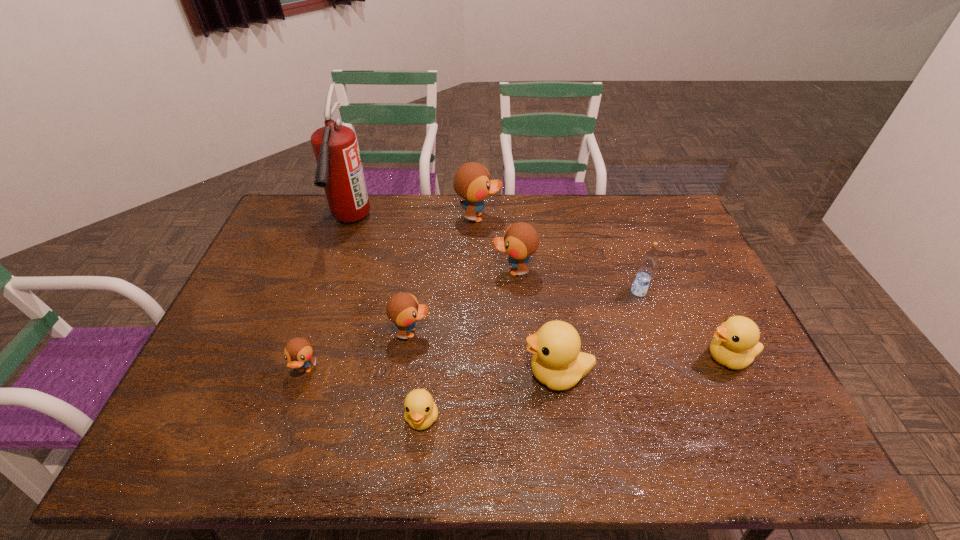
Select which duck is the third closest to the farthest duck. Please provide its 2D coordinates. Your answer should be formatted as a tuple, i.e. [(x, y)], where the tuple contains the x and y coordinates of a point satisfying the conditions above.

[(557, 362)]

Find the location of `duck object that ranks as the fourth closest to the second yellow duck from right to left`. duck object that ranks as the fourth closest to the second yellow duck from right to left is located at coordinates (735, 344).

At what (x,y) coordinates should I click in order to perform the action: click on blue duck that is the second closest one to the rightmost object. Please return your answer as a coordinate pair (x, y). Looking at the image, I should click on (472, 182).

The image size is (960, 540). I want to click on blue duck object that ranks as the second closest to the third farthest blue duck, so click(x=520, y=241).

Select which yellow duck appears as the second closest to the fire extinguisher. Please provide its 2D coordinates. Your answer should be formatted as a tuple, i.e. [(x, y)], where the tuple contains the x and y coordinates of a point satisfying the conditions above.

[(557, 362)]

Select which yellow duck appears as the closest to the farthest blue duck. Please provide its 2D coordinates. Your answer should be formatted as a tuple, i.e. [(x, y)], where the tuple contains the x and y coordinates of a point satisfying the conditions above.

[(557, 362)]

Where is `blank area in the image that satisfies the following two spatial constraints: 1. on the face of the biggest yellow duck; 2. on the face of the nearest object`? This screenshot has width=960, height=540. blank area in the image that satisfies the following two spatial constraints: 1. on the face of the biggest yellow duck; 2. on the face of the nearest object is located at coordinates (563, 417).

Image resolution: width=960 pixels, height=540 pixels. I want to click on free space that satisfies the following two spatial constraints: 1. on the front-facing side of the sixth nearest duck; 2. on the right side of the vodka, so click(516, 292).

Locate an element on the screen. This screenshot has height=540, width=960. free space that satisfies the following two spatial constraints: 1. on the front-facing side of the tallest duck; 2. on the back side of the sixth nearest object is located at coordinates (478, 292).

This screenshot has height=540, width=960. What are the coordinates of `free point that satisfies the following two spatial constraints: 1. on the front-facing side of the second farthest blue duck; 2. on the front-facing side of the leftmost duck` in the screenshot? It's located at click(521, 370).